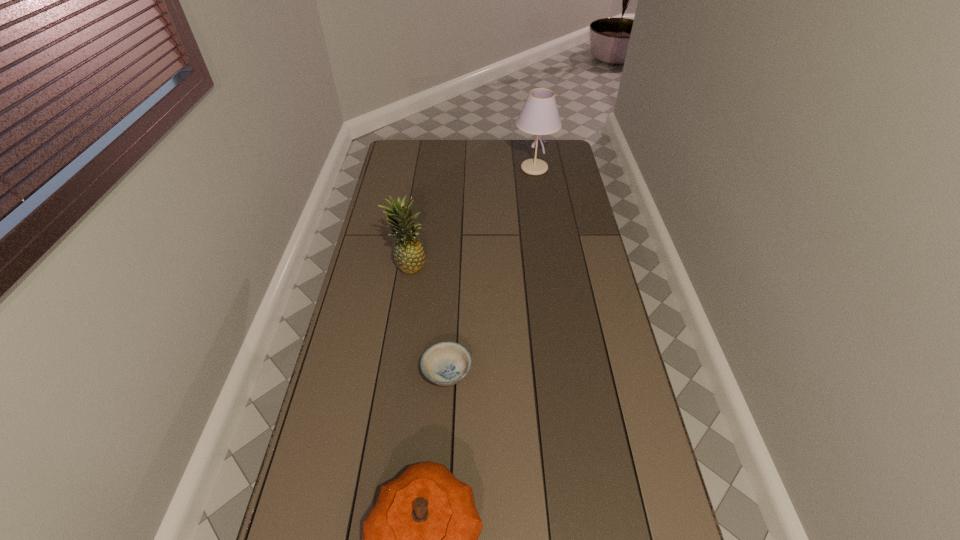
Find the location of `lampshade`. lampshade is located at coordinates (539, 116).

In order to click on the farthest object in this screenshot , I will do `click(539, 116)`.

Where is `the third nearest object`? The width and height of the screenshot is (960, 540). the third nearest object is located at coordinates (409, 255).

This screenshot has height=540, width=960. In order to click on the second tallest object in this screenshot , I will do `click(409, 255)`.

The width and height of the screenshot is (960, 540). What are the coordinates of `the shortest object` in the screenshot? It's located at (447, 363).

At what (x,y) coordinates should I click in order to perform the action: click on the second nearest object. Please return your answer as a coordinate pair (x, y). This screenshot has height=540, width=960. Looking at the image, I should click on (447, 363).

Locate an element on the screen. Image resolution: width=960 pixels, height=540 pixels. vacant region located on the back of the rightmost object is located at coordinates (532, 151).

This screenshot has height=540, width=960. I want to click on free space located on the right of the pineapple, so click(x=480, y=264).

The height and width of the screenshot is (540, 960). What are the coordinates of `blank space located on the left of the shortest object` in the screenshot? It's located at (406, 373).

Find the location of `object present at the far edge`. object present at the far edge is located at coordinates (539, 116).